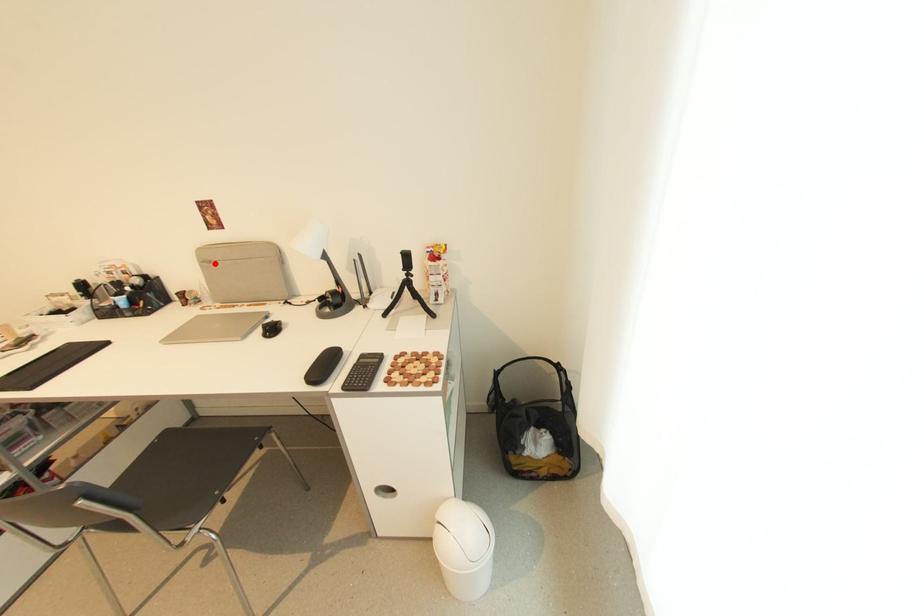
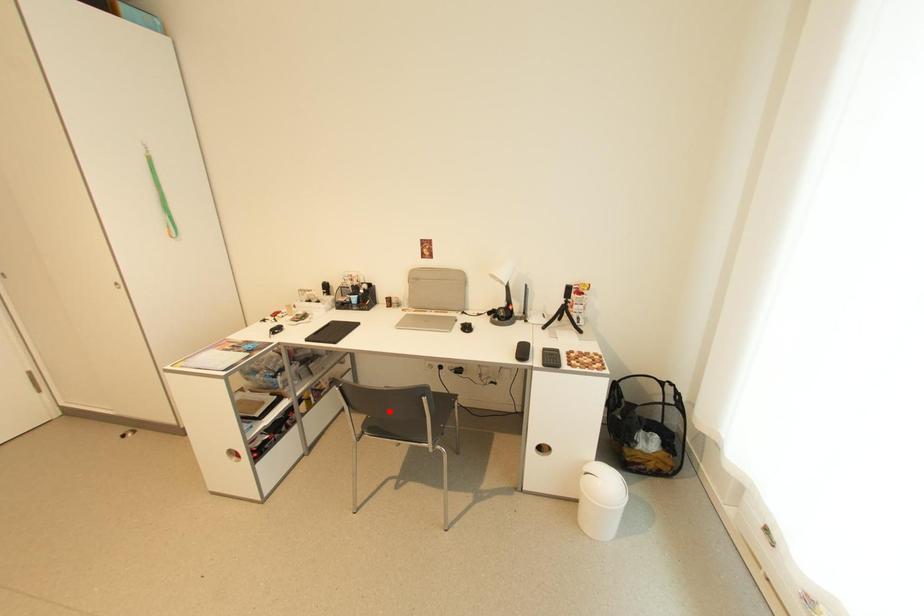
I am providing you with two images of the same scene from different viewpoints. A red point is marked on the first image and another point is marked on the second image. Is the red point in image1 aligned with the point shown in image2?

No